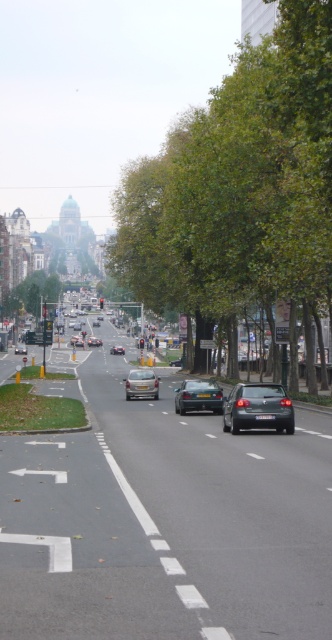
Question: Estimate the real-world distances between objects in this image. Which object is closer to the metallic silver car at center?

Choices:
 (A) green leafy tree at center
 (B) green leafy tree at left
 (C) matte black car at left
 (D) silver metallic car at center

Answer: (A)

Question: Based on their relative distances, which object is nearer to the silver metallic sedan at center?

Choices:
 (A) metallic silver sedan at center
 (B) green leafy tree at left

Answer: (B)

Question: Which point is closer to the camera taking this photo?

Choices:
 (A) (95, 326)
 (B) (247, 404)
 (C) (25, 355)
 (D) (79, 336)

Answer: (B)

Question: From the image, what is the correct spatial relationship of glossy black car at lower right in relation to metallic silver sedan at center?

Choices:
 (A) below
 (B) above

Answer: (B)

Question: Can you confirm if glossy black car at lower right is wider than metallic silver car at center?

Choices:
 (A) yes
 (B) no

Answer: (A)

Question: Does matte black car at left have a lesser width compared to matte silver sedan at center?

Choices:
 (A) no
 (B) yes

Answer: (A)